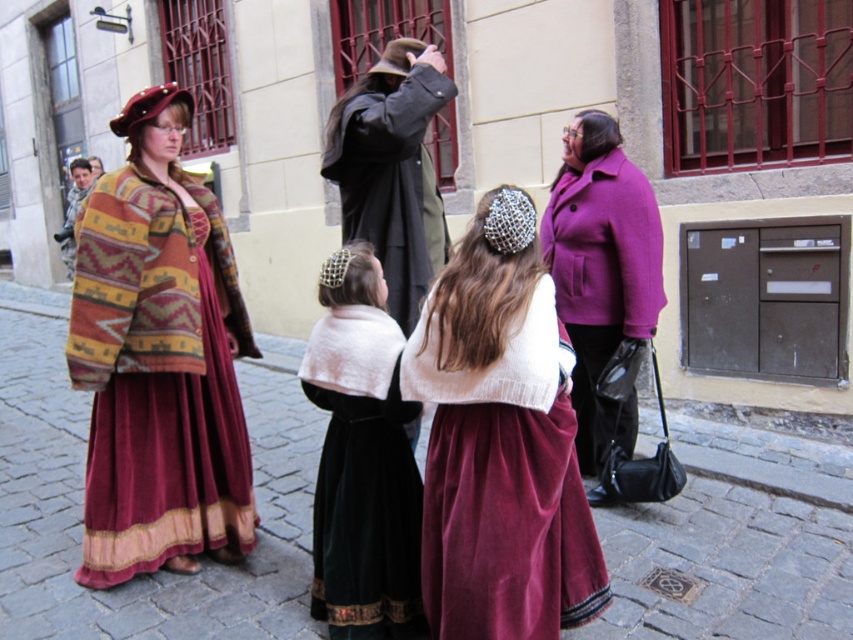
You are a costume designer observing the scene. You need to determine which of the two central garments, the velvet black dress at center or the dark gray wool coat at center, is more suitable for a character that requires a taller silhouette. Which one should you choose?

The velvet black dress at center is taller than the dark gray wool coat at center, so it is more suitable for a character requiring a taller silhouette.